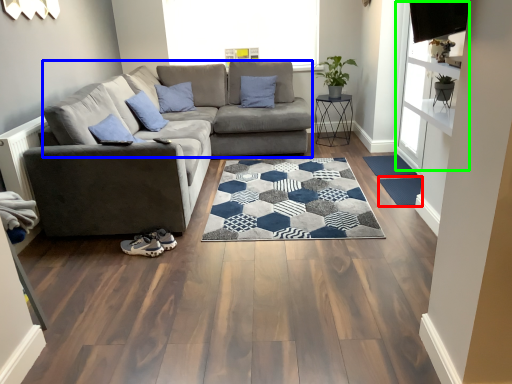
Question: Which is nearer to the doormat (highlighted by a red box)? couch (highlighted by a blue box) or window screen (highlighted by a green box).

Choices:
 (A) couch
 (B) window screen

Answer: (B)